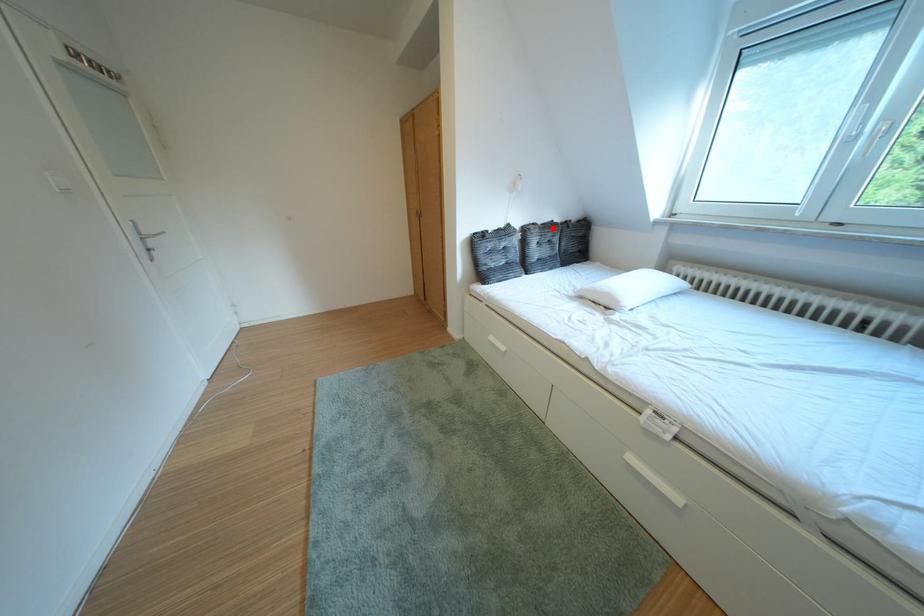
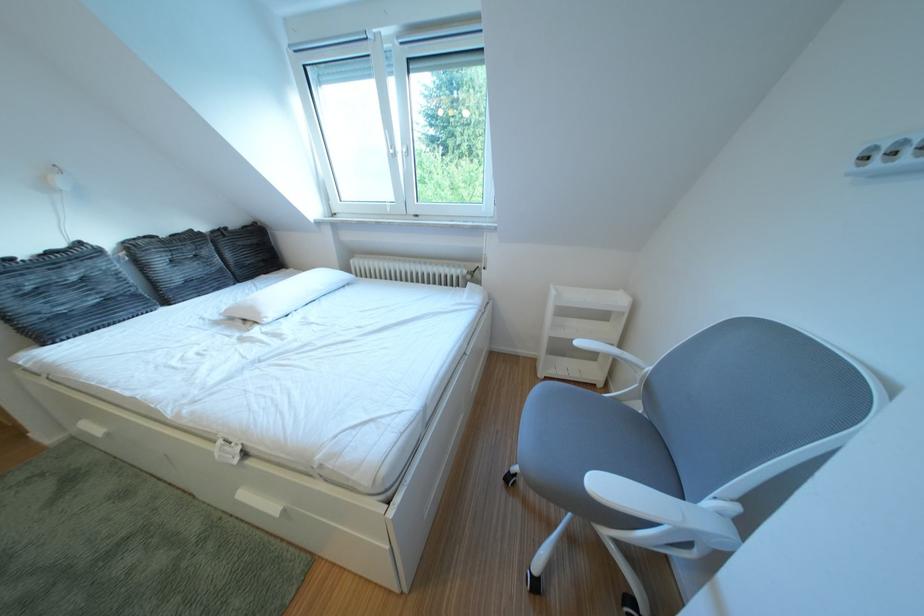
Question: I am providing you with two images of the same scene from different viewpoints. A red point is shown in image1. For the corresponding object point in image2, is it positioned nearer or farther from the camera?

Choices:
 (A) Nearer
 (B) Farther

Answer: (B)